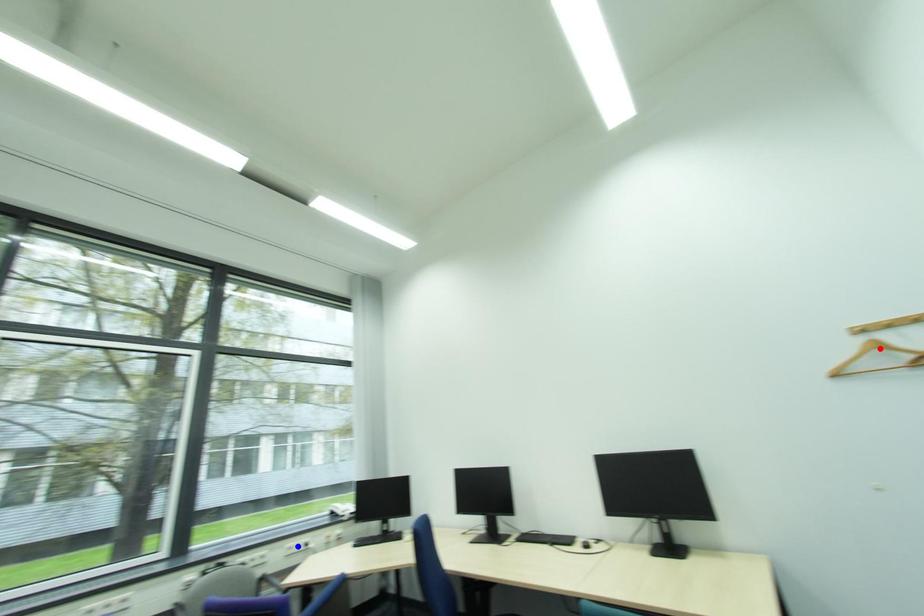
Question: In the image, two points are highlighted. Which point is nearer to the camera? Reply with the corresponding letter.

Choices:
 (A) blue point
 (B) red point

Answer: (B)